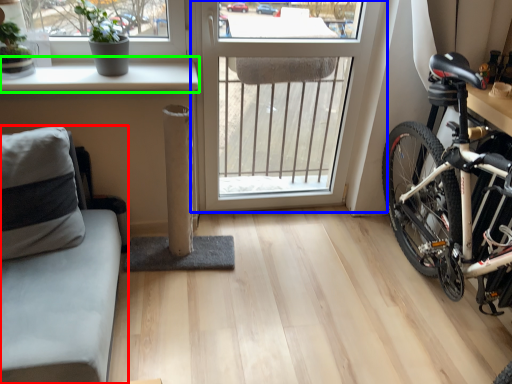
Question: Which object is positioned farthest from studio couch (highlighted by a red box)? Select from window (highlighted by a blue box) and window sill (highlighted by a green box).

Choices:
 (A) window
 (B) window sill

Answer: (A)